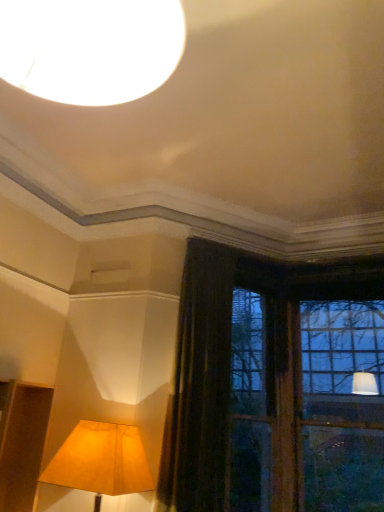
Question: From the image's perspective, is dark velvet curtain at center over matte yellow fabric lampshade at lower left?

Choices:
 (A) yes
 (B) no

Answer: (A)

Question: From a real-world perspective, is dark velvet curtain at center over matte yellow fabric lampshade at lower left?

Choices:
 (A) yes
 (B) no

Answer: (A)

Question: Does dark velvet curtain at center have a greater width compared to matte yellow fabric lampshade at lower left?

Choices:
 (A) no
 (B) yes

Answer: (A)

Question: Can you confirm if dark velvet curtain at center is taller than matte yellow fabric lampshade at lower left?

Choices:
 (A) yes
 (B) no

Answer: (A)

Question: Is dark velvet curtain at center positioned beyond the bounds of matte yellow fabric lampshade at lower left?

Choices:
 (A) yes
 (B) no

Answer: (A)

Question: Does dark velvet curtain at center have a larger size compared to matte yellow fabric lampshade at lower left?

Choices:
 (A) no
 (B) yes

Answer: (B)

Question: Is matte yellow fabric lampshade at lower left to the left of dark velvet curtain at center from the viewer's perspective?

Choices:
 (A) yes
 (B) no

Answer: (A)

Question: Considering the relative sizes of matte yellow fabric lampshade at lower left and dark velvet curtain at center in the image provided, is matte yellow fabric lampshade at lower left smaller than dark velvet curtain at center?

Choices:
 (A) no
 (B) yes

Answer: (B)

Question: Is matte yellow fabric lampshade at lower left not close to dark velvet curtain at center?

Choices:
 (A) yes
 (B) no

Answer: (B)

Question: Is matte yellow fabric lampshade at lower left behind dark velvet curtain at center?

Choices:
 (A) no
 (B) yes

Answer: (A)

Question: Is matte yellow fabric lampshade at lower left positioned before dark velvet curtain at center?

Choices:
 (A) no
 (B) yes

Answer: (B)

Question: Considering the relative sizes of matte yellow fabric lampshade at lower left and dark velvet curtain at center in the image provided, is matte yellow fabric lampshade at lower left thinner than dark velvet curtain at center?

Choices:
 (A) no
 (B) yes

Answer: (A)

Question: Based on their sizes in the image, would you say dark velvet curtain at center is bigger or smaller than matte yellow fabric lampshade at lower left?

Choices:
 (A) small
 (B) big

Answer: (B)